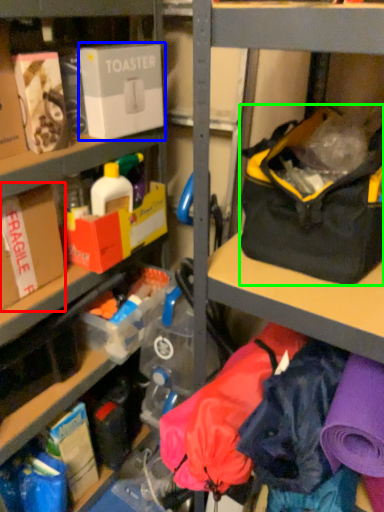
Question: Which is farther away from box (highlighted by a red box)? box (highlighted by a blue box) or handbag (highlighted by a green box)?

Choices:
 (A) box
 (B) handbag

Answer: (B)